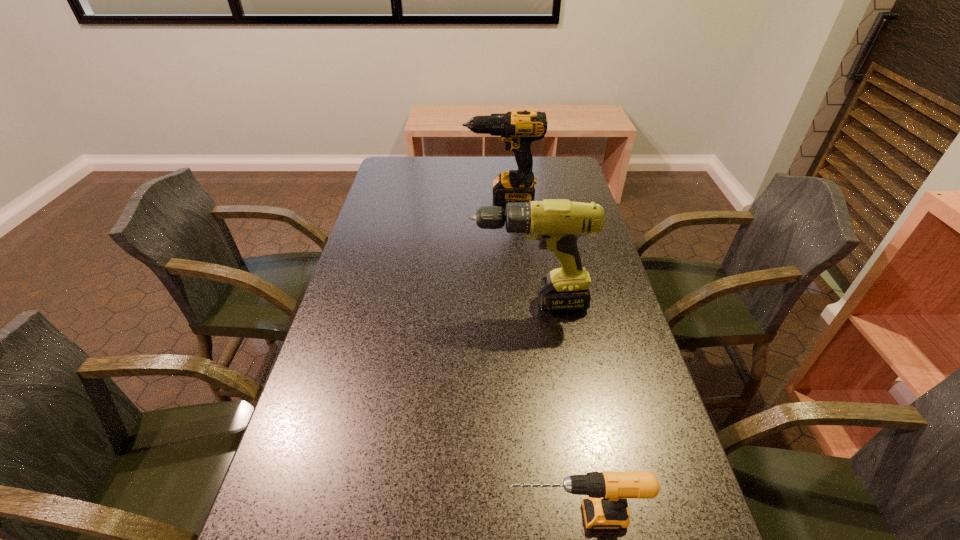
Locate an element on the screen. This screenshot has height=540, width=960. the farthest object is located at coordinates (518, 129).

Find the location of a particular element. This screenshot has width=960, height=540. the second farthest drill is located at coordinates (557, 223).

This screenshot has width=960, height=540. In order to click on the nearest object in this screenshot , I will do `click(606, 508)`.

Identify the location of the shortest drill. (606, 508).

Locate an element on the screen. This screenshot has width=960, height=540. blank space located 0.290m at the tip of the farthest object is located at coordinates tap(383, 198).

The image size is (960, 540). I want to click on free space located 0.270m at the tip of the farthest object, so click(389, 198).

What are the coordinates of `vacant space positioned at the tip of the farthest object` in the screenshot? It's located at (450, 198).

Identify the location of vacant space located on the handle side of the second nearest object. The height and width of the screenshot is (540, 960). (388, 303).

Image resolution: width=960 pixels, height=540 pixels. I want to click on free point located on the handle side of the second nearest object, so point(396,303).

You are a GUI agent. You are given a task and a screenshot of the screen. Output one action in this format:
    pyautogui.click(x=<x>, y=<y>)
    Task: Click on the vacant space situated on the handle side of the second nearest object
    This screenshot has width=960, height=540.
    Given the screenshot: What is the action you would take?
    click(x=361, y=303)